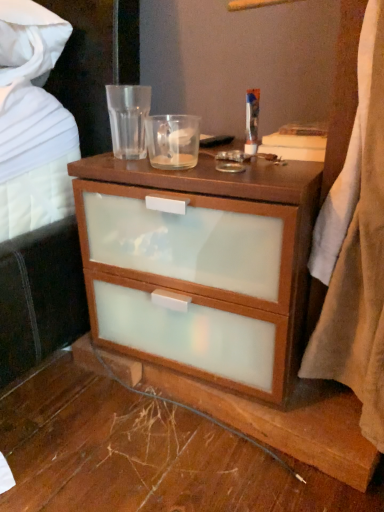
You are a GUI agent. You are given a task and a screenshot of the screen. Output one action in this format:
    pyautogui.click(x=<x>, y=<y>)
    Task: Click on the beige soft blanket at right
    The image size is (384, 512).
    Given the screenshot: What is the action you would take?
    pyautogui.click(x=356, y=249)

What do you see at coordinates (356, 249) in the screenshot?
I see `beige soft blanket at right` at bounding box center [356, 249].

Image resolution: width=384 pixels, height=512 pixels. Identify the location of beige soft blanket at right. (356, 249).